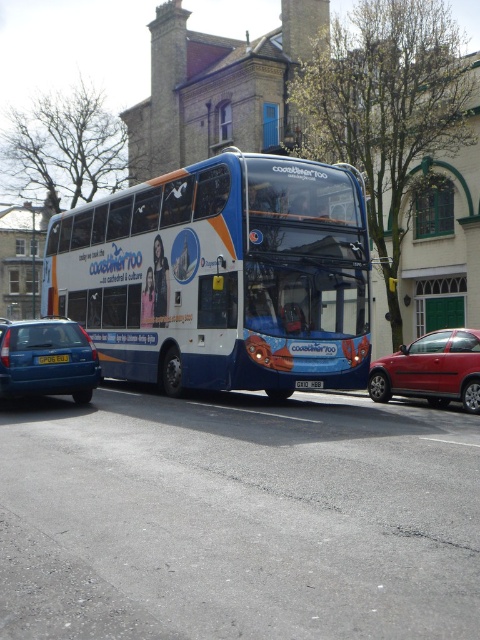
How distant is blue metallic bus at center from metallic red sedan at right?

blue metallic bus at center is 14.38 feet from metallic red sedan at right.

Is point (326, 246) positioned after point (458, 400)?

No, (326, 246) is in front of (458, 400).

You are a GUI agent. You are given a task and a screenshot of the screen. Output one action in this format:
    pyautogui.click(x=<x>, y=<y>)
    Task: Click on the blue metallic bus at center
    
    Given the screenshot: What is the action you would take?
    pyautogui.click(x=222, y=276)

Looking at this image, between metallic blue sedan at left and white plastic license plate at center, which one has more height?

Standing taller between the two is metallic blue sedan at left.

Who is more forward, [9,387] or [301,381]?

Point [9,387] is in front.

Is point (36, 369) positioned after point (304, 380)?

No, it is in front of (304, 380).

At what (x,y) coordinates should I click in order to perform the action: click on metallic blue sedan at left. Please return your answer as a coordinate pair (x, y). This screenshot has height=640, width=480. Looking at the image, I should click on tap(47, 355).

Who is shorter, blue metallic bus at center or yellow plastic license plate at center?

yellow plastic license plate at center is shorter.

Measure the distance from blue metallic bus at center to yellow plastic license plate at center.

blue metallic bus at center is 4.24 meters away from yellow plastic license plate at center.

Where is `blue metallic bus at center`? This screenshot has width=480, height=640. blue metallic bus at center is located at coordinates (222, 276).

Where is `blue metallic bus at center`? The height and width of the screenshot is (640, 480). blue metallic bus at center is located at coordinates (222, 276).